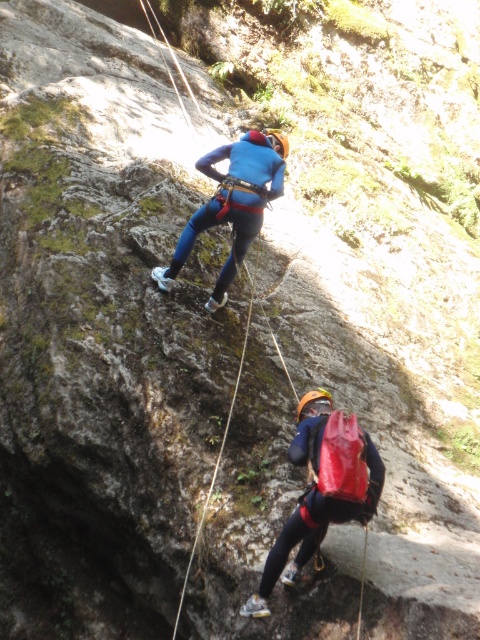
Does matte red backpack at lower center have a lesser width compared to blue matte climbing suit at center?

Correct, matte red backpack at lower center's width is less than blue matte climbing suit at center's.

Does matte red backpack at lower center have a greater height compared to blue matte climbing suit at center?

In fact, matte red backpack at lower center may be shorter than blue matte climbing suit at center.

Does point (371, 477) lie behind point (192, 228)?

That is False.

Identify the location of matte red backpack at lower center. (322, 490).